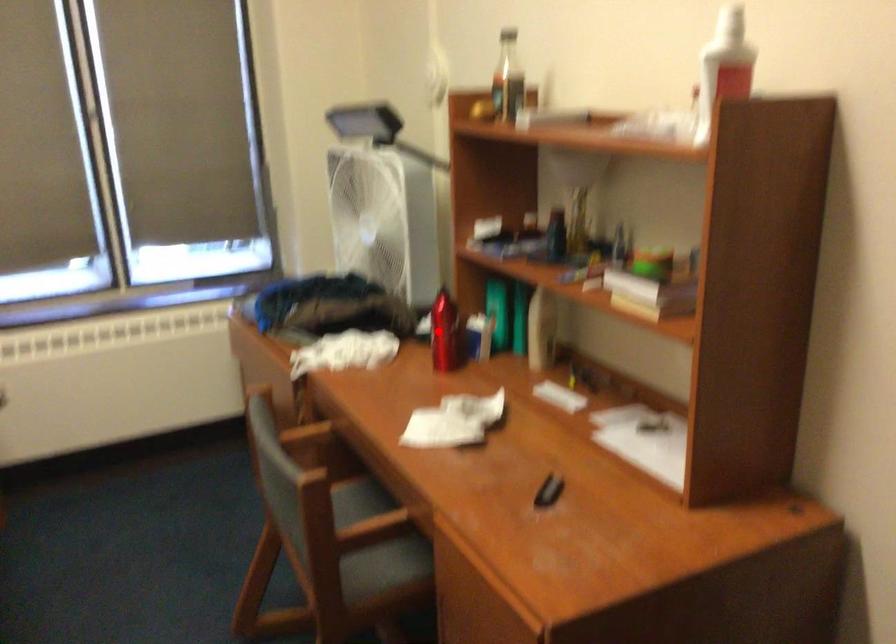
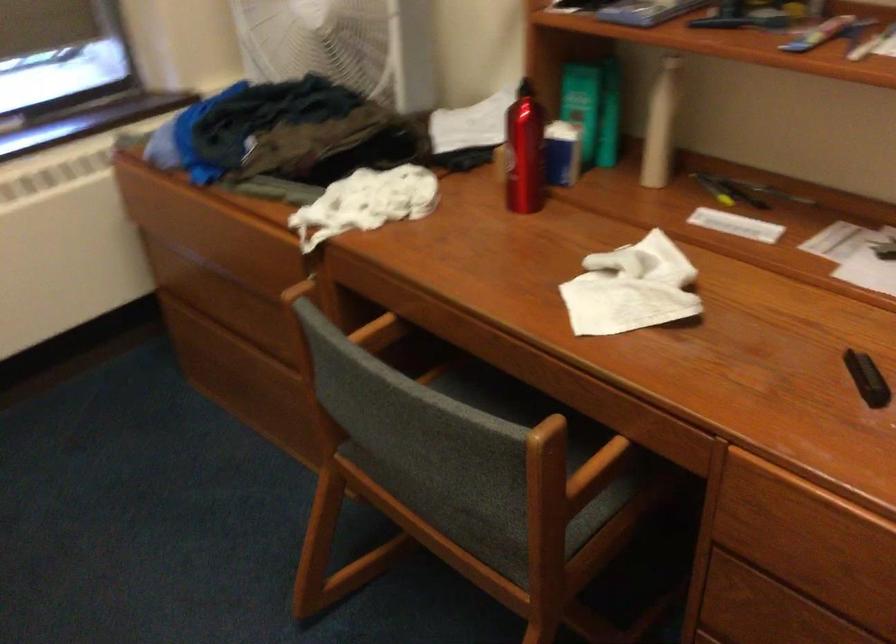
Locate, in the second image, the point that corresponds to the highlighted location in the first image.

(524, 152)